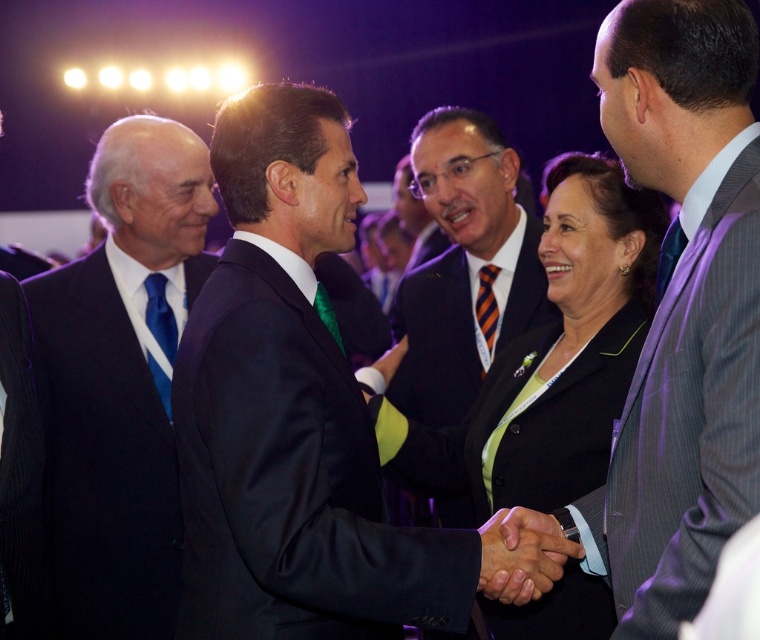
Question: Considering the real-world distances, which object is closest to the navy blue suit at center?

Choices:
 (A) black pinstripe suit at left
 (B) blue silk tie at left
 (C) smooth leather hand at center
 (D) blue silk tie at center

Answer: (C)

Question: In this image, where is blue silk tie at left located relative to black matte blazer at center?

Choices:
 (A) right
 (B) left

Answer: (B)

Question: Which point is closer to the camera taking this photo?

Choices:
 (A) (0, 451)
 (B) (483, 280)

Answer: (A)

Question: Which point is closer to the camera taking this photo?

Choices:
 (A) (33, 476)
 (B) (163, 403)

Answer: (A)

Question: Does navy blue suit at center come behind orange striped tie at center?

Choices:
 (A) no
 (B) yes

Answer: (A)

Question: Can you confirm if navy blue suit at center is positioned below blue silk tie at left?

Choices:
 (A) yes
 (B) no

Answer: (A)